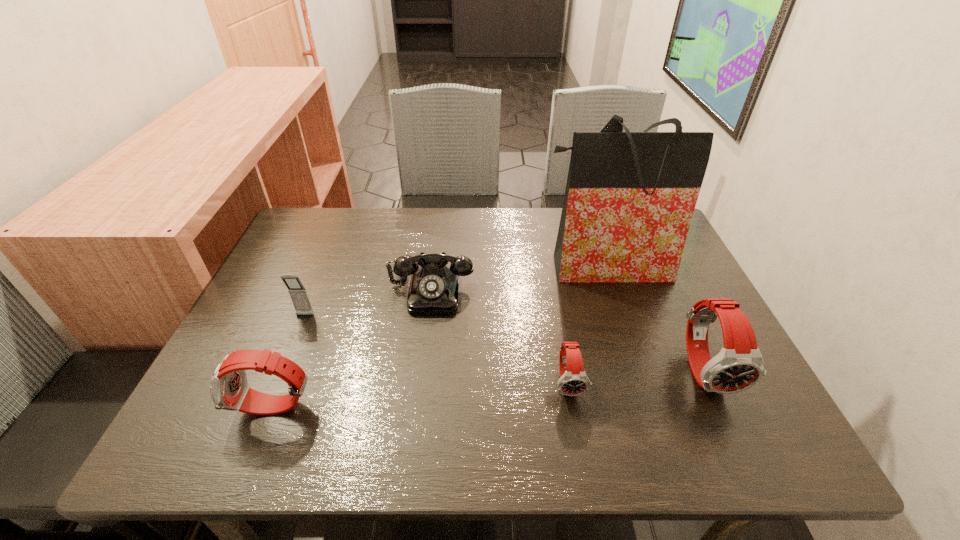
Image resolution: width=960 pixels, height=540 pixels. What are the coordinates of `vacant region located on the front side of the tallest object` in the screenshot? It's located at (623, 325).

Identify the location of object present at the far edge. (630, 196).

Image resolution: width=960 pixels, height=540 pixels. I want to click on watch situated at the left edge, so click(x=229, y=389).

What are the coordinates of `cellular telephone situated at the left edge` in the screenshot? It's located at (298, 293).

Image resolution: width=960 pixels, height=540 pixels. In order to click on watch present at the right edge in this screenshot , I will do `click(739, 365)`.

Locate an element on the screen. This screenshot has width=960, height=540. shopping bag present at the right edge is located at coordinates (630, 196).

Find the location of a particular element. This screenshot has width=960, height=540. object that is at the near left corner is located at coordinates (229, 389).

In order to click on object that is at the far right corner in this screenshot , I will do pyautogui.click(x=630, y=196).

Locate an element on the screen. This screenshot has width=960, height=540. object located at the near right corner is located at coordinates (739, 365).

Locate an element on the screen. Image resolution: width=960 pixels, height=540 pixels. vacant space at the far edge is located at coordinates (425, 210).